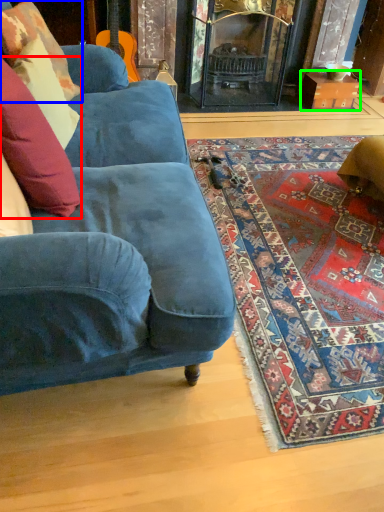
Question: Which object is positioned closest to pillow (highlighted by a red box)? Select from pillow (highlighted by a blue box) and cardboard box (highlighted by a green box).

Choices:
 (A) pillow
 (B) cardboard box

Answer: (A)